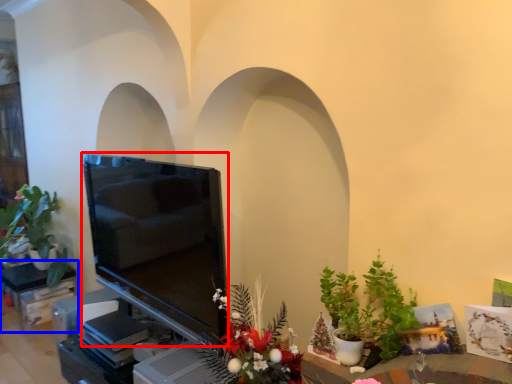
Question: Among these objects, which one is nearest to the camera, television (highlighted by a red box) or furniture (highlighted by a blue box)?

Choices:
 (A) television
 (B) furniture

Answer: (A)